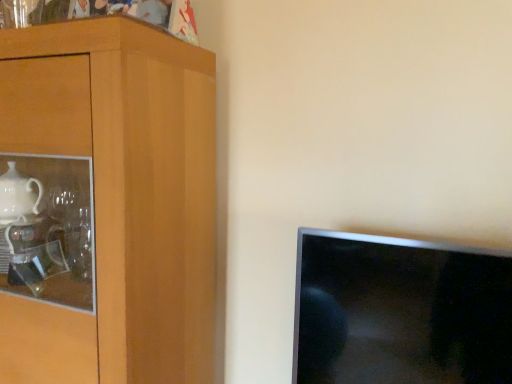
Question: Should I look upward or downward to see wooden cabinet at left?

Choices:
 (A) down
 (B) up

Answer: (A)